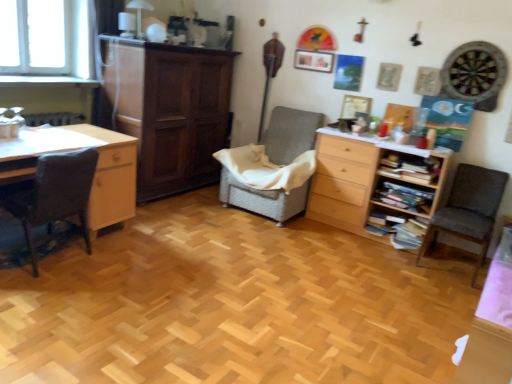
I want to click on vacant area that lies between light wood chest of drawers at center right and woven fabric chair at center, arranged as the 2th chair when viewed from the left, so click(323, 231).